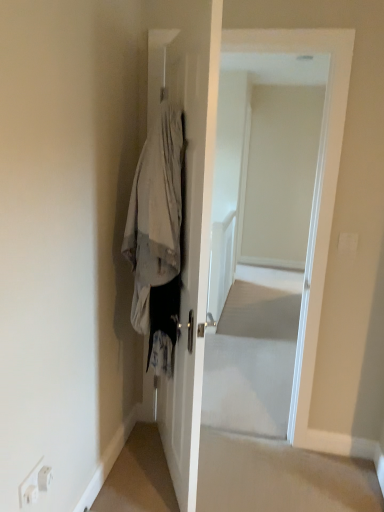
Question: Is white glossy door at center not inside denim jacket at center?

Choices:
 (A) yes
 (B) no

Answer: (A)

Question: From a real-world perspective, is white glossy door at center physically below denim jacket at center?

Choices:
 (A) yes
 (B) no

Answer: (A)

Question: Is white glossy door at center beside denim jacket at center?

Choices:
 (A) yes
 (B) no

Answer: (B)

Question: Can you confirm if white glossy door at center is shorter than denim jacket at center?

Choices:
 (A) yes
 (B) no

Answer: (B)

Question: From the image's perspective, is white glossy door at center on denim jacket at center?

Choices:
 (A) no
 (B) yes

Answer: (B)

Question: From the image's perspective, is white glossy door at center under denim jacket at center?

Choices:
 (A) yes
 (B) no

Answer: (B)

Question: Considering the relative sizes of denim jacket at center and white glossy door at center in the image provided, is denim jacket at center taller than white glossy door at center?

Choices:
 (A) yes
 (B) no

Answer: (B)

Question: Is denim jacket at center positioned in front of white glossy door at center?

Choices:
 (A) no
 (B) yes

Answer: (B)

Question: Are denim jacket at center and white glossy door at center located far from each other?

Choices:
 (A) yes
 (B) no

Answer: (A)

Question: From a real-world perspective, is denim jacket at center beneath white glossy door at center?

Choices:
 (A) no
 (B) yes

Answer: (A)

Question: Considering the relative sizes of denim jacket at center and white glossy door at center in the image provided, is denim jacket at center wider than white glossy door at center?

Choices:
 (A) yes
 (B) no

Answer: (A)

Question: From the image's perspective, is denim jacket at center on white glossy door at center?

Choices:
 (A) yes
 (B) no

Answer: (B)

Question: Do you think white glossy door at center is within denim jacket at center, or outside of it?

Choices:
 (A) inside
 (B) outside

Answer: (B)